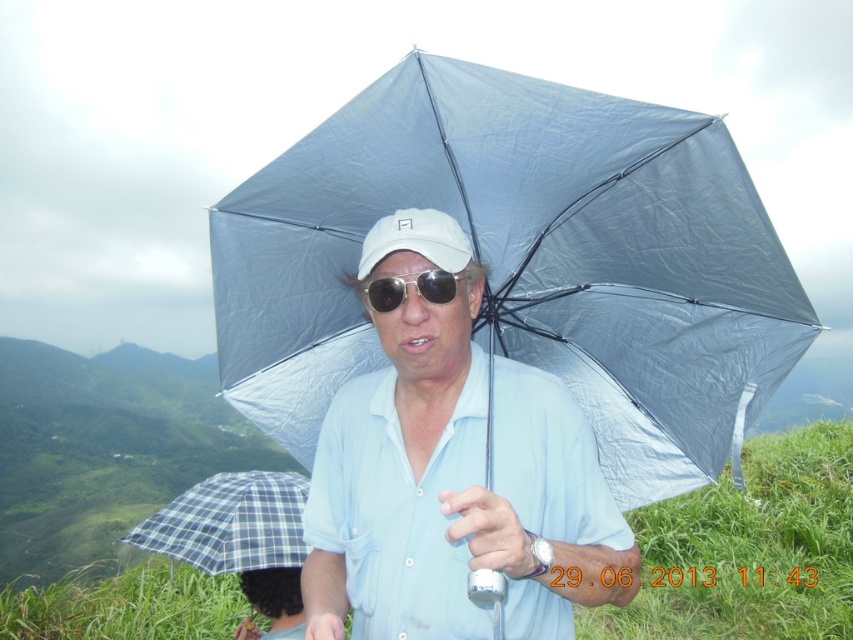
You are a photographer trying to capture the scene of the person with their matte blue shirt at center and gold metallic sunglasses at center. Which object is located to the left when focusing on the center of the image?

The matte blue shirt at center is positioned on the left side of gold metallic sunglasses at center.

You are planning to take a photo of the transparent fabric umbrella at center and the white matte baseball cap at center. Which object should you focus on first if you want to capture both in your shot without moving the camera?

You should focus on the transparent fabric umbrella at center first because it is taller than the white matte baseball cap at center, so adjusting focus to the taller object ensures both are in frame.